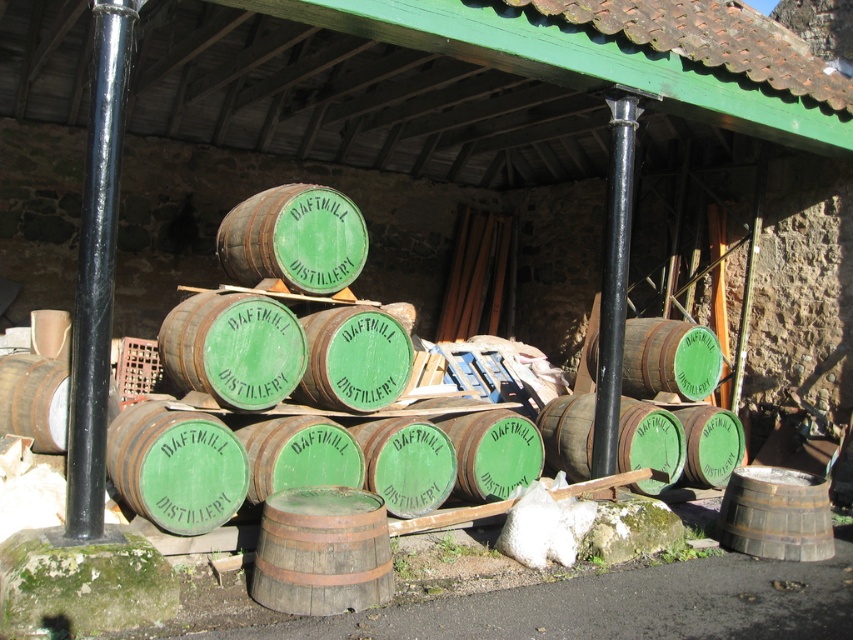
Which is more to the left, black metal pole at left or rustic wooden barrel at center?

Positioned to the left is black metal pole at left.

Is point (102, 460) less distant than point (276, 609)?

Yes, it is.

Who is more distant from viewer, [71,369] or [271,509]?

Point [71,369]

Identify the location of black metal pole at left. The height and width of the screenshot is (640, 853). (96, 273).

Does point (354, 548) come closer to viewer compared to point (709, 330)?

Yes, it is in front of point (709, 330).

Between point (358, 554) and point (688, 365), which one is positioned behind?

The point (688, 365) is behind.

Between point (335, 579) and point (674, 356), which one is positioned behind?

Point (674, 356)

The width and height of the screenshot is (853, 640). What are the coordinates of `rustic wooden barrel at center` in the screenshot? It's located at (322, 552).

Who is shorter, black metal pole at left or green wooden barrel at center?

Standing shorter between the two is green wooden barrel at center.

Between black metal pole at left and green wooden barrel at center, which one appears on the left side from the viewer's perspective?

From the viewer's perspective, black metal pole at left appears more on the left side.

This screenshot has width=853, height=640. In order to click on black metal pole at left in this screenshot , I will do `click(96, 273)`.